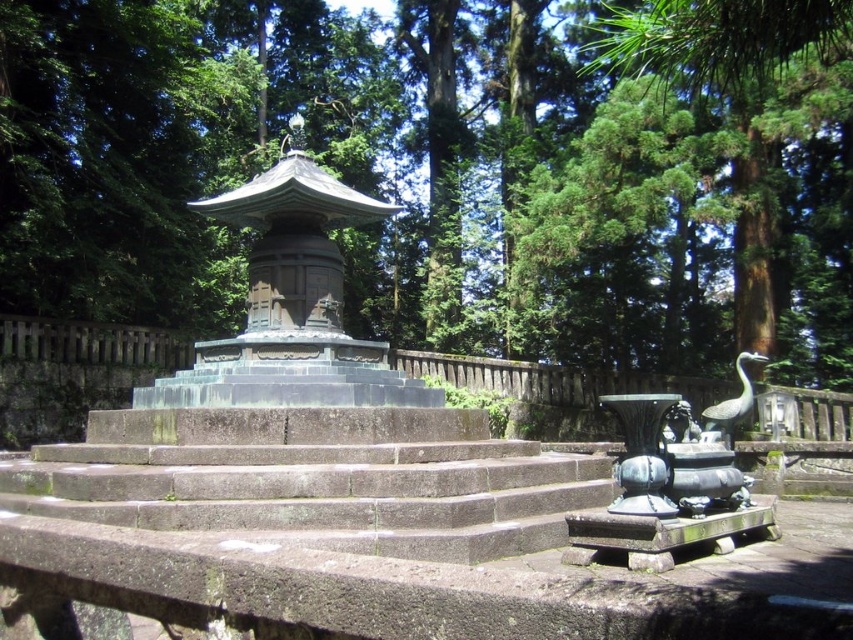
You are standing at the entrance of a Japanese garden and see the green leafy tree at center and the gray stone stairs at center. Which object is positioned more to the left from your viewpoint?

The green leafy tree at center is positioned to the left of the gray stone stairs at center, so the green leafy tree at center is more to the left.

You are standing at point (431, 180) in the image. What do you see around you?

You are standing at point (431, 180) where the green leafy tree at center is located.